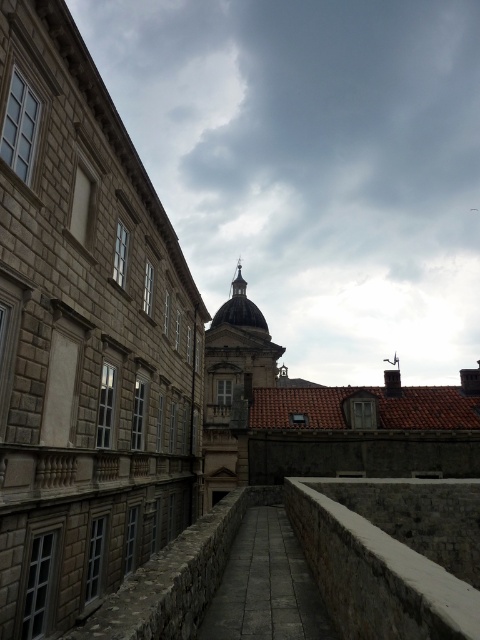
Question: Does white stone ledge at center have a larger size compared to brown stone ledge at center?

Choices:
 (A) yes
 (B) no

Answer: (B)

Question: Where is white stone ledge at center located in relation to brown stone ledge at center in the image?

Choices:
 (A) right
 (B) left

Answer: (A)

Question: Is white stone ledge at center smaller than brown stone ledge at center?

Choices:
 (A) no
 (B) yes

Answer: (B)

Question: Which of the following is the farthest from the observer?

Choices:
 (A) white stone ledge at center
 (B) brown stone ledge at center

Answer: (B)